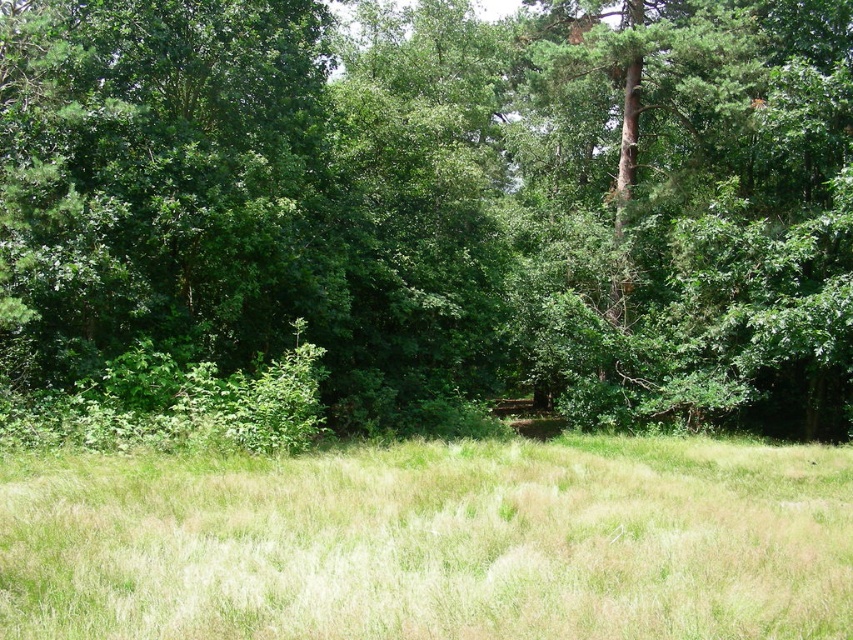
Which is in front, point (248, 13) or point (608, 464)?

Point (608, 464) is more forward.

Is green leafy tree at center below green grassy field at center?

No.

Who is more distant from viewer, (532, 332) or (809, 497)?

Point (532, 332)

Locate an element on the screen. green leafy tree at center is located at coordinates (440, 204).